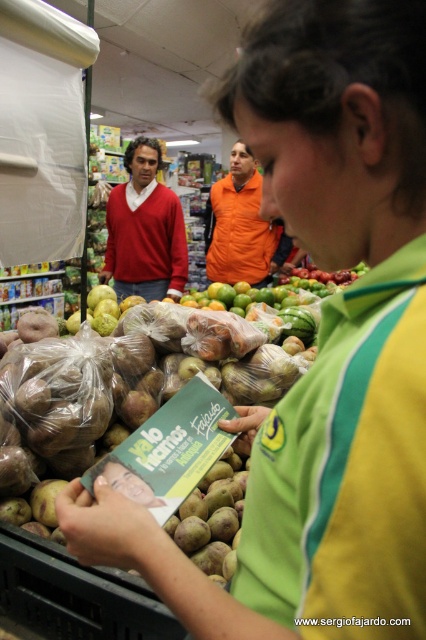
This screenshot has width=426, height=640. What do you see at coordinates (144, 228) in the screenshot?
I see `matte red sweater at upper left` at bounding box center [144, 228].

Which is in front, point (146, 248) or point (236, 163)?

Point (146, 248)

Where is `matte red sweater at upper left`? matte red sweater at upper left is located at coordinates (144, 228).